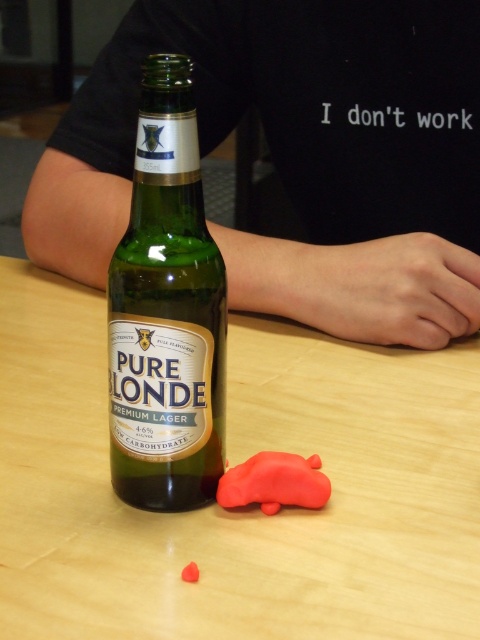
Is wooden table at center thinner than black cotton shirt at upper center?

In fact, wooden table at center might be wider than black cotton shirt at upper center.

The image size is (480, 640). Describe the element at coordinates (241, 508) in the screenshot. I see `wooden table at center` at that location.

This screenshot has width=480, height=640. What do you see at coordinates (241, 508) in the screenshot?
I see `wooden table at center` at bounding box center [241, 508].

This screenshot has width=480, height=640. Find the location of `wooden table at center`. wooden table at center is located at coordinates (241, 508).

Does wooden table at center have a lesser height compared to rubber car at lower center?

No, wooden table at center is not shorter than rubber car at lower center.

Does wooden table at center have a smaller size compared to rubber car at lower center?

No.

Find the location of a particular element. wooden table at center is located at coordinates (241, 508).

Is point (168, 426) less distant than point (253, 484)?

Yes, it is in front of point (253, 484).

Is green glass bottle at center closer to the viewer compared to rubber car at lower center?

Yes.

Who is more distant from viewer, (x=139, y=116) or (x=284, y=461)?

Positioned behind is point (x=139, y=116).

The image size is (480, 640). Find the location of `green glass bottle at center`. green glass bottle at center is located at coordinates (167, 312).